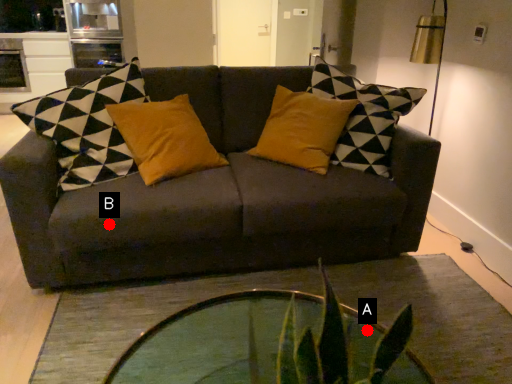
Question: Two points are circled on the image, labeled by A and B beside each circle. Which point is closer to the camera?

Choices:
 (A) A is closer
 (B) B is closer

Answer: (A)